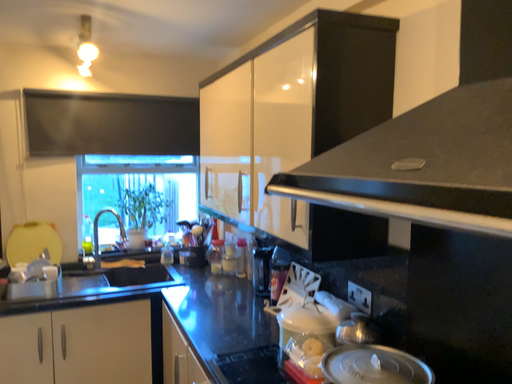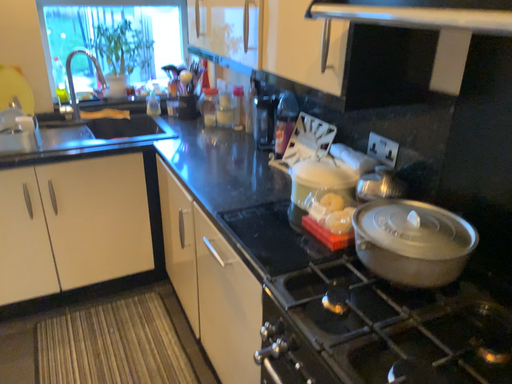
Question: Which way did the camera rotate in the video?

Choices:
 (A) rotated upward
 (B) rotated downward

Answer: (B)